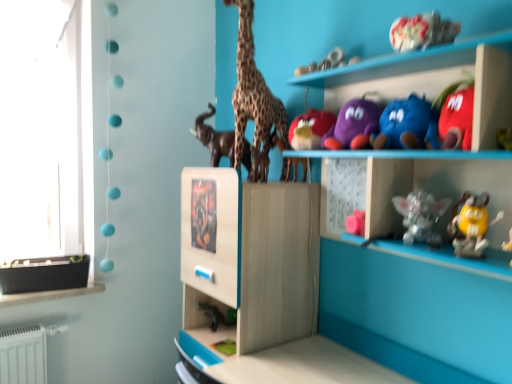
Question: From the image's perspective, is matte plush bird at center, which is counted as the fifth toy, starting from the bottom, above or below satin silver figurine at center-right, which is the sixth toy in top-to-bottom order?

Choices:
 (A) above
 (B) below

Answer: (A)

Question: Is matte plush bird at center, which is counted as the fifth toy, starting from the bottom, spatially inside satin silver figurine at center-right, the third toy positioned from the bottom, or outside of it?

Choices:
 (A) outside
 (B) inside

Answer: (A)

Question: Which of these objects is positioned farthest from the purple plush toy at upper center, marked as the 3th toy in a top-to-bottom arrangement?

Choices:
 (A) metallic silver dragon at center
 (B) fluffy plush toy at upper center, which ranks as the eighth toy in bottom-to-top order
 (C) spotted fur giraffe at center
 (D) black glossy elephant at center, acting as the seventh toy starting from the bottom
 (E) yellow rubber duck at lower right, which ranks as the second toy in bottom-to-top order

Answer: (A)

Question: Which object is the farthest from the metallic silver dragon at center?

Choices:
 (A) black glossy elephant at center, placed as the second toy when sorted from top to bottom
 (B) spotted fur giraffe at center
 (C) matte plush bird at center, the 4th toy in the top-to-bottom sequence
 (D) fluffy plush toy at upper center, which ranks as the eighth toy in bottom-to-top order
 (E) green rubber frog at lower center, the 1th toy positioned from the bottom

Answer: (D)